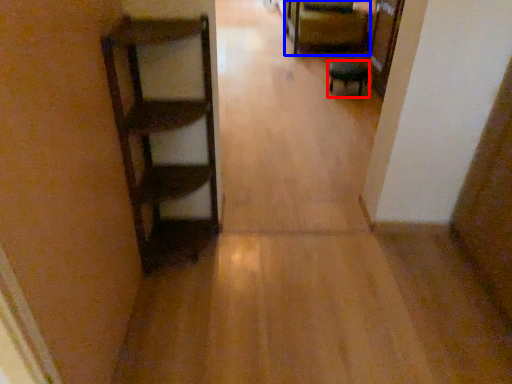
Question: Which object appears closest to the camera in this image, furniture (highlighted by a red box) or furniture (highlighted by a blue box)?

Choices:
 (A) furniture
 (B) furniture

Answer: (A)